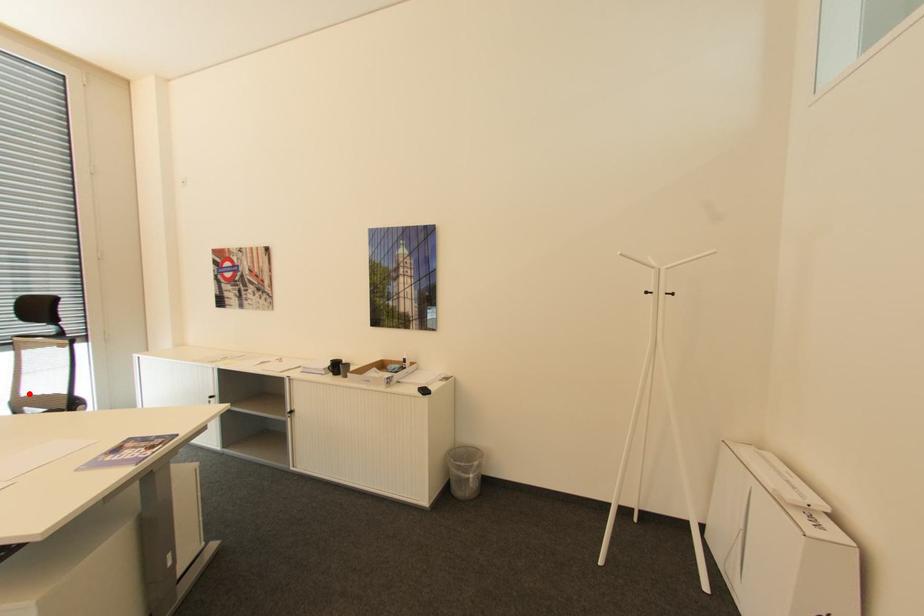
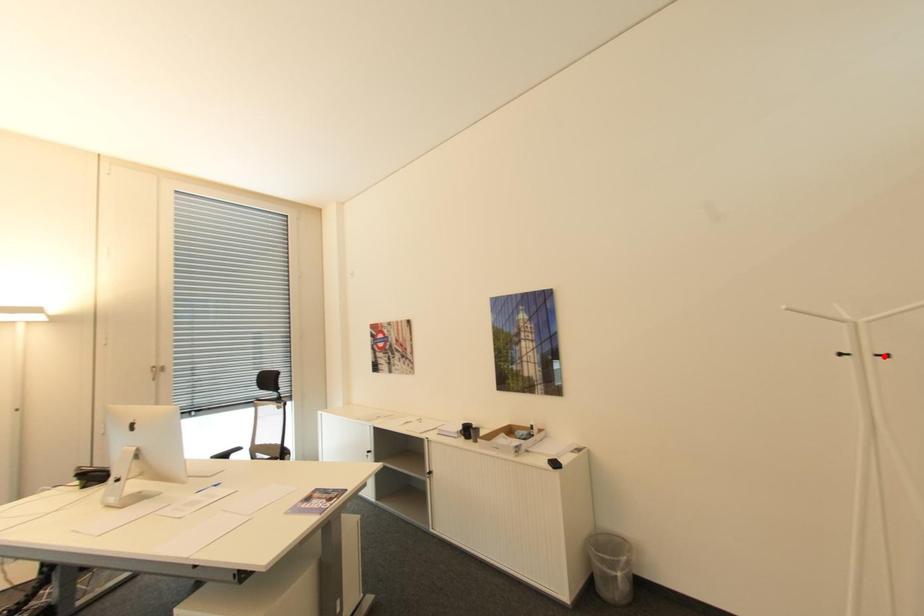
I am providing you with two images of the same scene from different viewpoints. A red point is marked on the first image and another point is marked on the second image. Are the points marked in image1 and image2 representing the same 3D position?

No